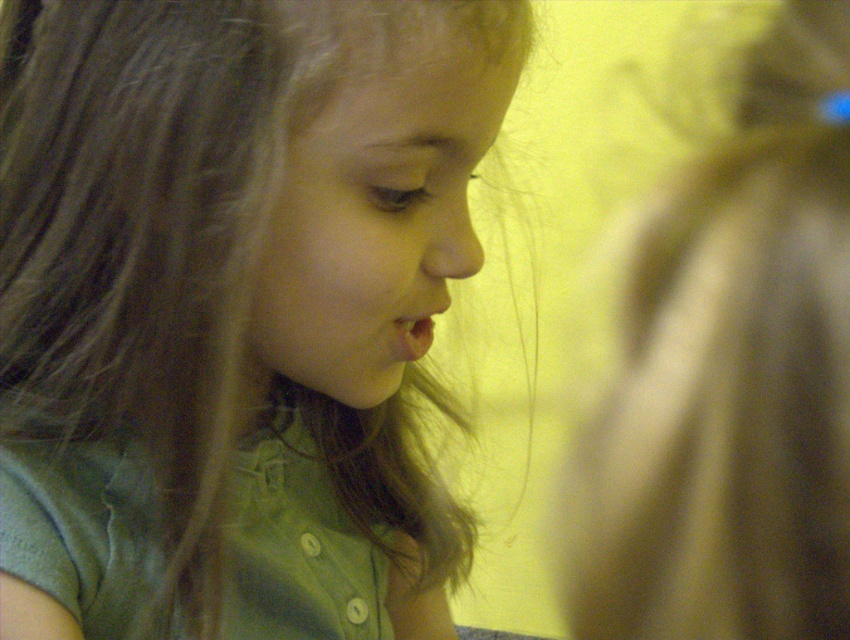
You are a photographer adjusting the lighting for a portrait. You notice two sections of the girl with brown smooth hair at center and brown silky hair at upper right. Which section of her hair is wider?

The brown smooth hair at center is wider than the brown silky hair at upper right.

You are a photographer trying to capture a portrait of the brown smooth hair at center. If your camera lens has a minimum focusing distance of 12 inches, will you need to adjust your position to ensure the subject is in focus?

The distance between the brown smooth hair at center and the viewer is 13.10 inches, which is beyond the camera lens minimum focusing distance of 12 inches. Therefore, you need to move closer to the subject to ensure it is in focus.

You are a photographer trying to adjust the lighting for a portrait. You notice the subject has two distinct sections of hair in the image. The first is the brown smooth hair at center and the second is the brown silky hair at upper right. Which of these hair sections appears taller in the frame?

The brown smooth hair at center appears much taller in the frame compared to the brown silky hair at upper right.